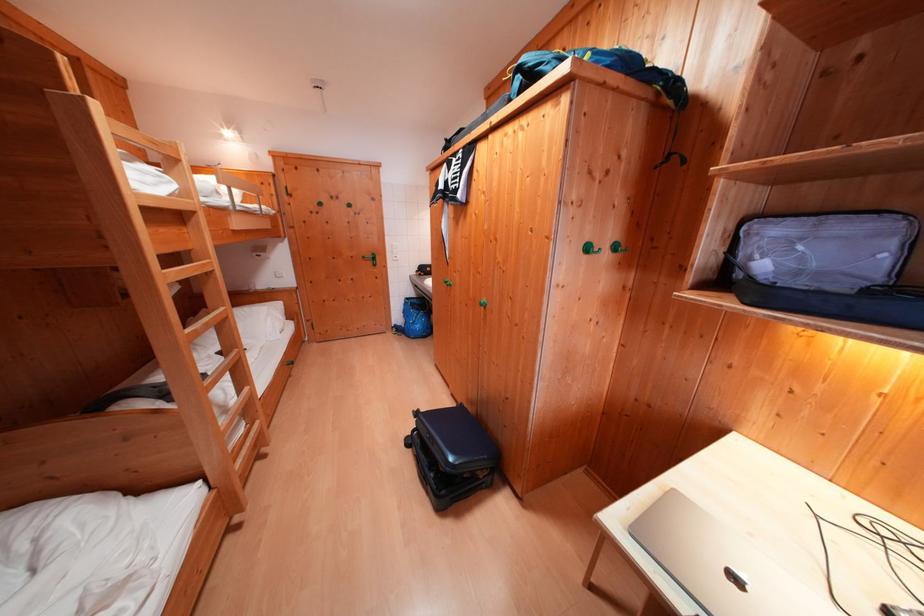
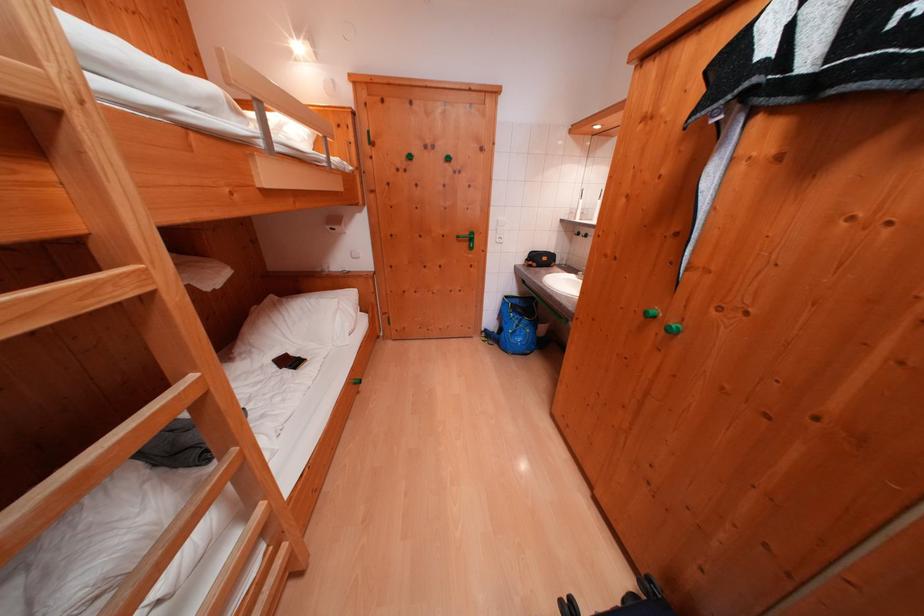
Find the pixel in the second image that matches (x=416, y=302) in the first image.

(515, 301)